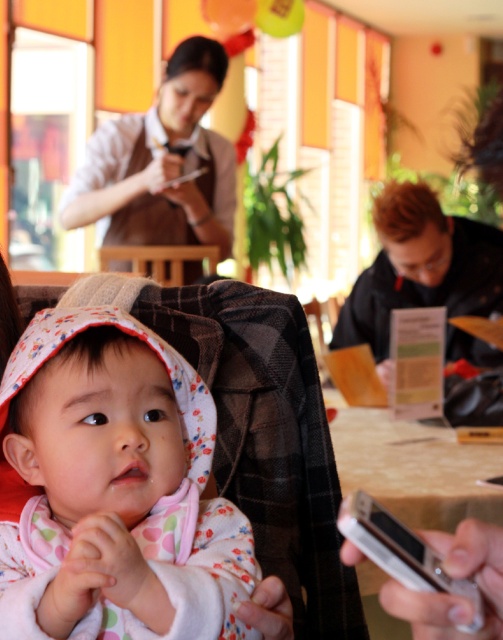
Is floral fabric baby at center smaller than white glossy table at lower right?

Correct, floral fabric baby at center occupies less space than white glossy table at lower right.

Does floral fabric baby at center appear under white glossy table at lower right?

Incorrect, floral fabric baby at center is not positioned below white glossy table at lower right.

Which is in front, point (173, 531) or point (451, 452)?

Point (173, 531) is more forward.

Identify the location of floral fabric baby at center. This screenshot has width=503, height=640. (116, 490).